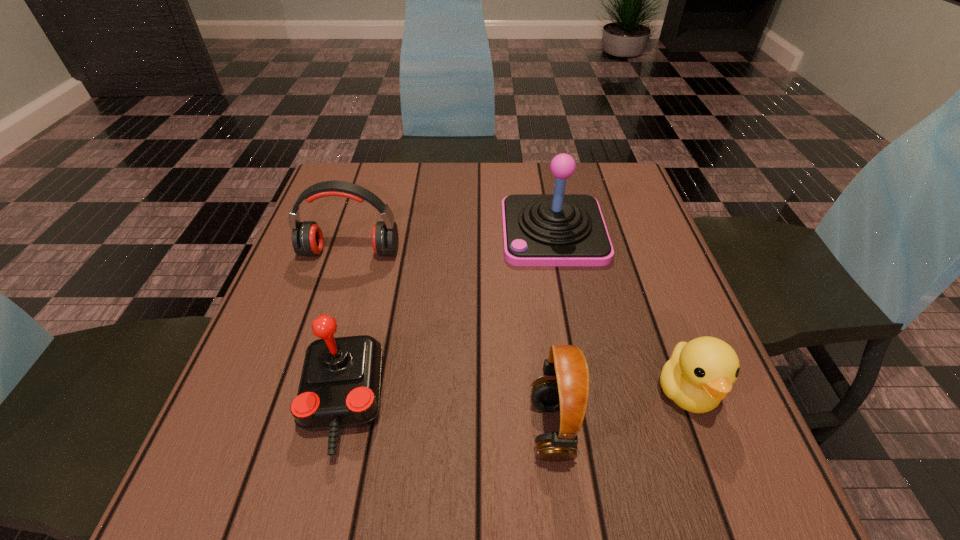
The image size is (960, 540). Identify the location of unoccupied area between the shortest object and the taller joystick. (620, 312).

At what (x,y) coordinates should I click in order to perform the action: click on unoccupied area between the taller joystick and the headset. Please return your answer as a coordinate pair (x, y). This screenshot has width=960, height=540. Looking at the image, I should click on click(552, 330).

Identify the location of object that is the closest to the nearer joystick. This screenshot has width=960, height=540. (307, 239).

Identify which object is located as the second nearest to the nearer joystick. Please provide its 2D coordinates. Your answer should be formatted as a tuple, i.e. [(x, y)], where the tuple contains the x and y coordinates of a point satisfying the conditions above.

[(564, 386)]

Where is `vacant region that satisfies the following two spatial constraints: 1. on the ear cups of the earphone; 2. on the right side of the left joystick`? vacant region that satisfies the following two spatial constraints: 1. on the ear cups of the earphone; 2. on the right side of the left joystick is located at coordinates (304, 402).

At what (x,y) coordinates should I click in order to perform the action: click on vacant space that satisfies the following two spatial constraints: 1. forward from the base of the farther joystick; 2. on the ear cups of the earphone. Please return your answer as a coordinate pair (x, y). The image size is (960, 540). Looking at the image, I should click on (557, 252).